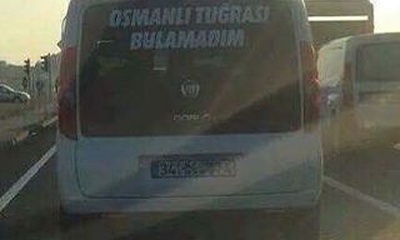
The image size is (400, 240). In order to click on white plate in this screenshot , I will do `click(192, 170)`.